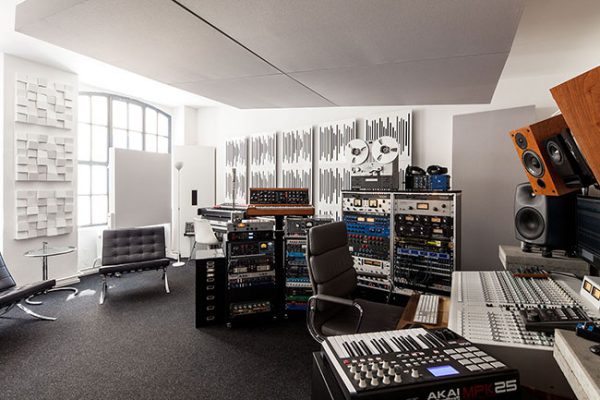
Where is `stereo equipment`? The width and height of the screenshot is (600, 400). stereo equipment is located at coordinates (246, 266), (297, 235), (370, 227), (409, 237).